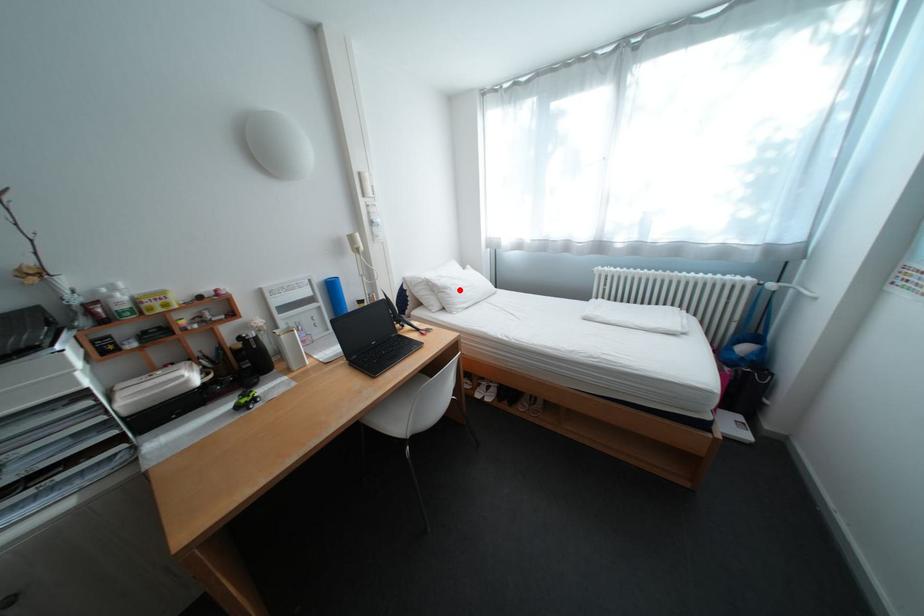
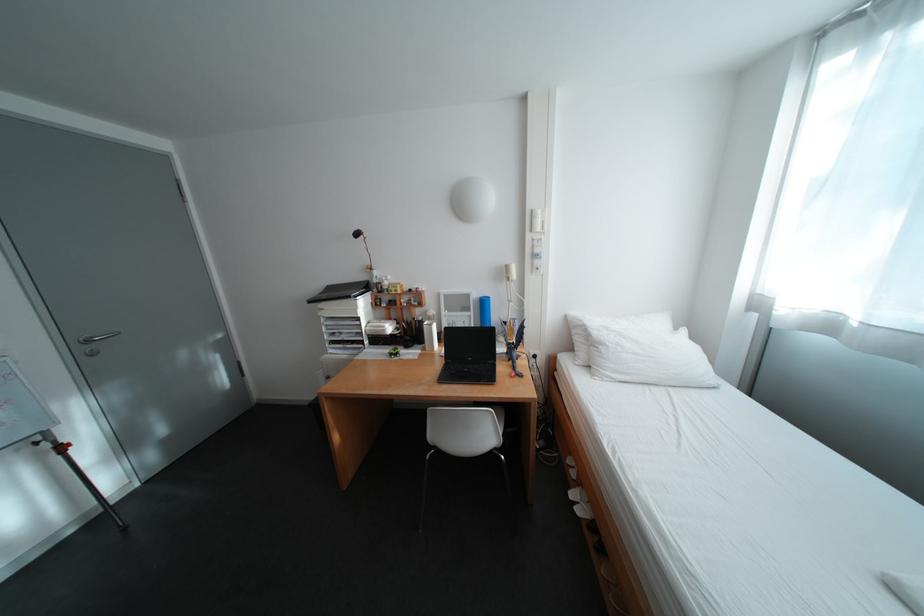
Question: I am providing you with two images of the same scene from different viewpoints. A red point is marked on the first image. Can you still see the location of the red point in image 2?

Choices:
 (A) Yes
 (B) No

Answer: (A)